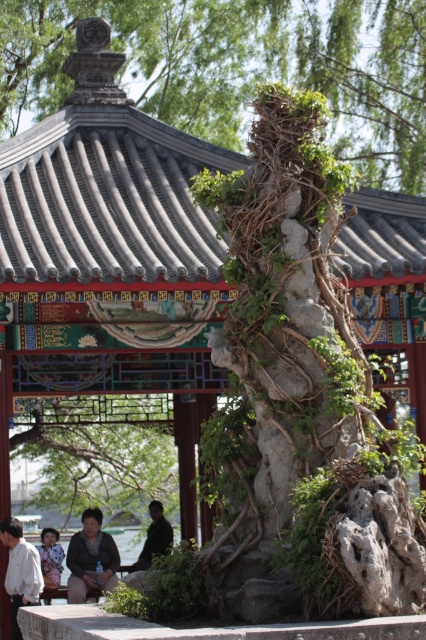
Between point (92, 432) and point (157, 524), which one is positioned in front?

Point (157, 524) is in front.

Can you confirm if green leafy tree at center is thinner than dark brown leather jacket at lower center?

Incorrect, green leafy tree at center's width is not less than dark brown leather jacket at lower center's.

Image resolution: width=426 pixels, height=640 pixels. I want to click on green leafy tree at center, so click(x=100, y=452).

Is point (68, 602) positioned after point (23, 556)?

Yes, it is.

Image resolution: width=426 pixels, height=640 pixels. Describe the element at coordinates (91, 557) in the screenshot. I see `matte black jacket at lower left` at that location.

Where is `matte black jacket at lower left`? matte black jacket at lower left is located at coordinates (91, 557).

Who is shorter, green leafy tree at upper center or floral-patterned fabric at lower left?

With less height is floral-patterned fabric at lower left.

Is green leafy tree at upper center shorter than floral-patterned fabric at lower left?

In fact, green leafy tree at upper center may be taller than floral-patterned fabric at lower left.

You are a GUI agent. You are given a task and a screenshot of the screen. Output one action in this format:
    pyautogui.click(x=<x>, y=<y>)
    Task: Click on the green leafy tree at upper center
    This screenshot has height=640, width=426.
    Given the screenshot: What is the action you would take?
    pyautogui.click(x=241, y=67)